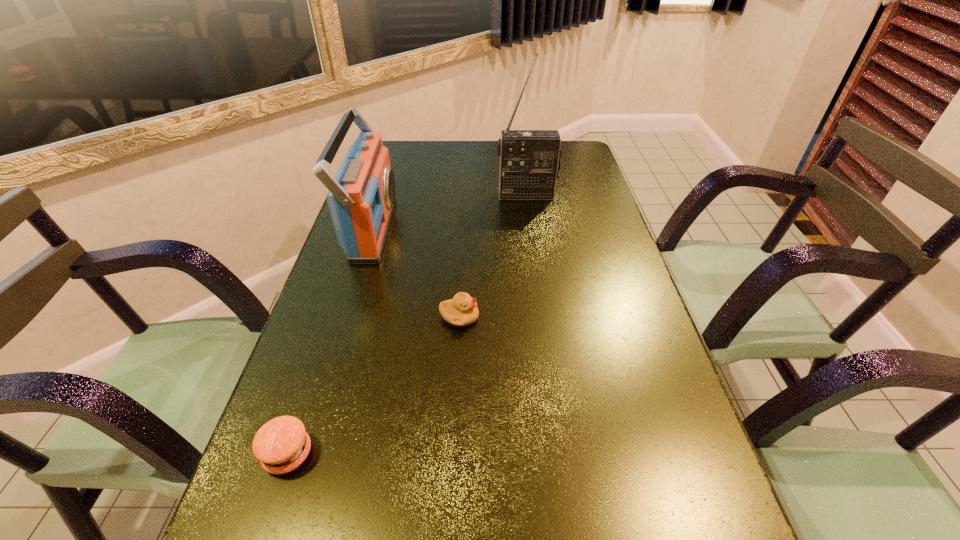
The width and height of the screenshot is (960, 540). I want to click on free space that satisfies the following two spatial constraints: 1. on the display of the tallest object; 2. on the front-facing side of the third object from left to right, so click(544, 317).

Identify the location of vacant region that satisfies the following two spatial constraints: 1. on the front-facing side of the third shortest object; 2. on the front side of the nearest object. (302, 454).

I want to click on free region that satisfies the following two spatial constraints: 1. on the front-facing side of the shorter radio receiver; 2. on the front side of the nearest object, so click(302, 454).

Where is `free space that satisfies the following two spatial constraints: 1. on the display of the rightmost object; 2. on the front-facing side of the third shortest object`? The height and width of the screenshot is (540, 960). free space that satisfies the following two spatial constraints: 1. on the display of the rightmost object; 2. on the front-facing side of the third shortest object is located at coordinates (532, 229).

The height and width of the screenshot is (540, 960). I want to click on free region that satisfies the following two spatial constraints: 1. on the display of the right radio receiver; 2. on the front-facing side of the duckling, so click(x=544, y=317).